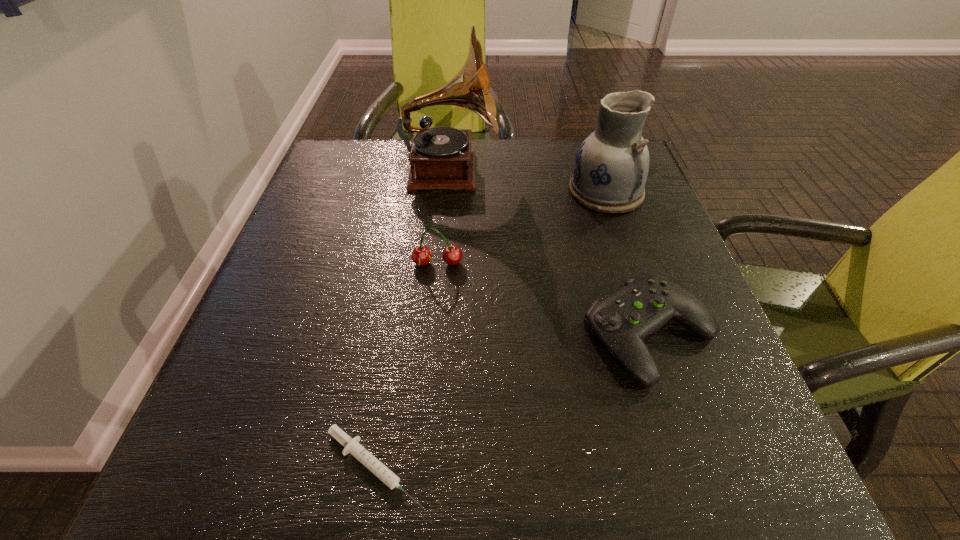
The height and width of the screenshot is (540, 960). Identify the location of free point that satisfies the following two spatial constraints: 1. on the back side of the fourth shortest object; 2. on the right side of the second shortest object. (602, 192).